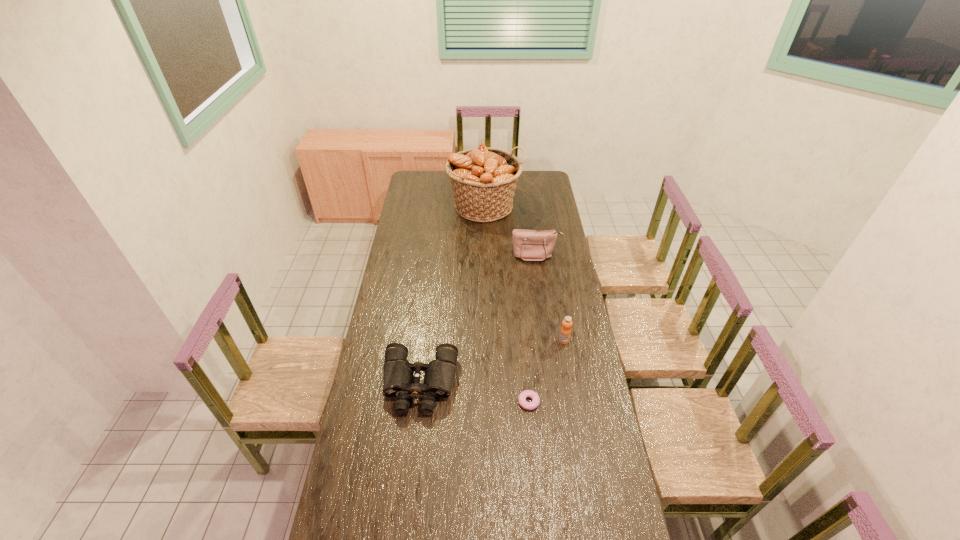
Identify the location of free location that satisfies the following two spatial constraints: 1. through the eyepieces of the doughnut; 2. on the right side of the fourth tallest object. The image size is (960, 540). (418, 402).